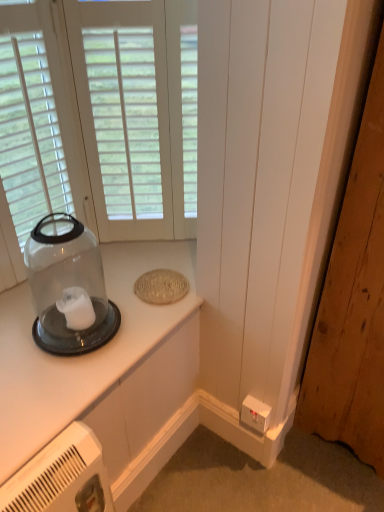
Identify the location of free spot to the right of transparent glass jar at left. The width and height of the screenshot is (384, 512). click(x=141, y=327).